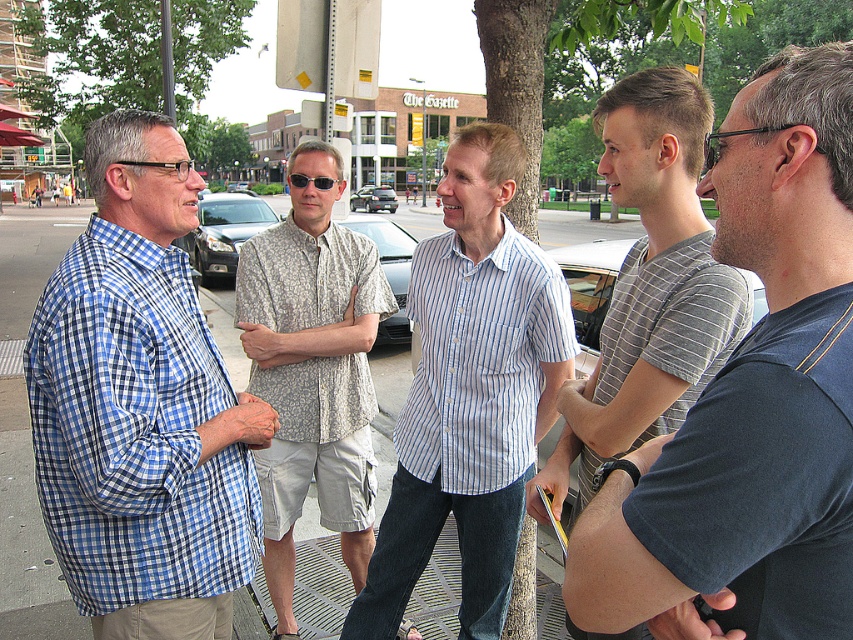
Question: Is floral-patterned shirt at center to the left of gray striped shirt at center from the viewer's perspective?

Choices:
 (A) no
 (B) yes

Answer: (B)

Question: Which of these objects is positioned farthest from the blue striped shirt at center?

Choices:
 (A) gray striped shirt at right
 (B) sunglasses at center

Answer: (A)

Question: Is blue checkered shirt at left wider than sunglasses at center?

Choices:
 (A) yes
 (B) no

Answer: (A)

Question: Which point is farther to the camera?

Choices:
 (A) (299, 179)
 (B) (610, 372)

Answer: (A)

Question: Can you confirm if gray striped shirt at right is positioned to the left of gray striped shirt at center?

Choices:
 (A) yes
 (B) no

Answer: (A)

Question: Which object is the closest to the gray striped shirt at center?

Choices:
 (A) blue checkered shirt at left
 (B) blue striped shirt at center
 (C) gray striped shirt at right

Answer: (B)